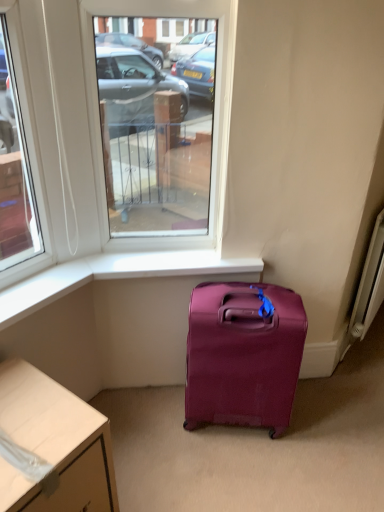
Locate an element on the screen. space that is in front of matte purple suitcase at lower center is located at coordinates (217, 467).